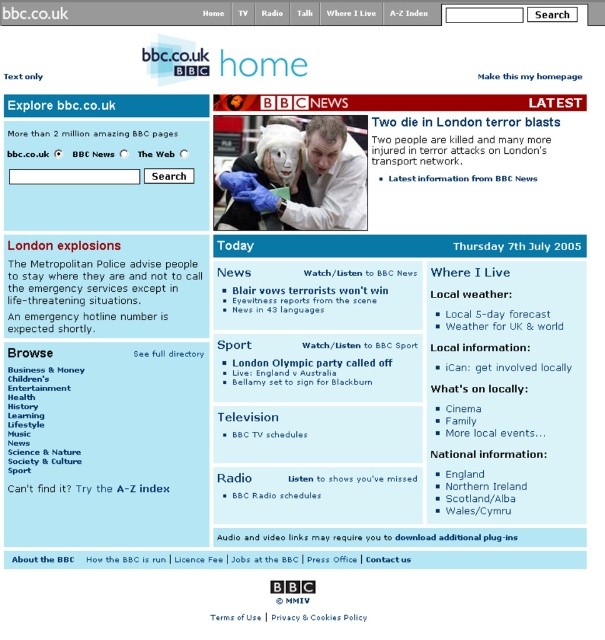
Question: Among these objects, which one is farthest from the camera?

Choices:
 (A) matte white lab coat at center
 (B) white paper at upper left

Answer: (A)

Question: In this image, where is white paper at upper left located relative to matte white lab coat at center?

Choices:
 (A) above
 (B) below

Answer: (B)

Question: Can you confirm if white paper at upper left is positioned above matte white lab coat at center?

Choices:
 (A) yes
 (B) no

Answer: (B)

Question: Does white paper at upper left lie behind matte white lab coat at center?

Choices:
 (A) yes
 (B) no

Answer: (B)

Question: Which of the following is the farthest from the observer?

Choices:
 (A) white paper at upper left
 (B) matte white lab coat at center

Answer: (B)